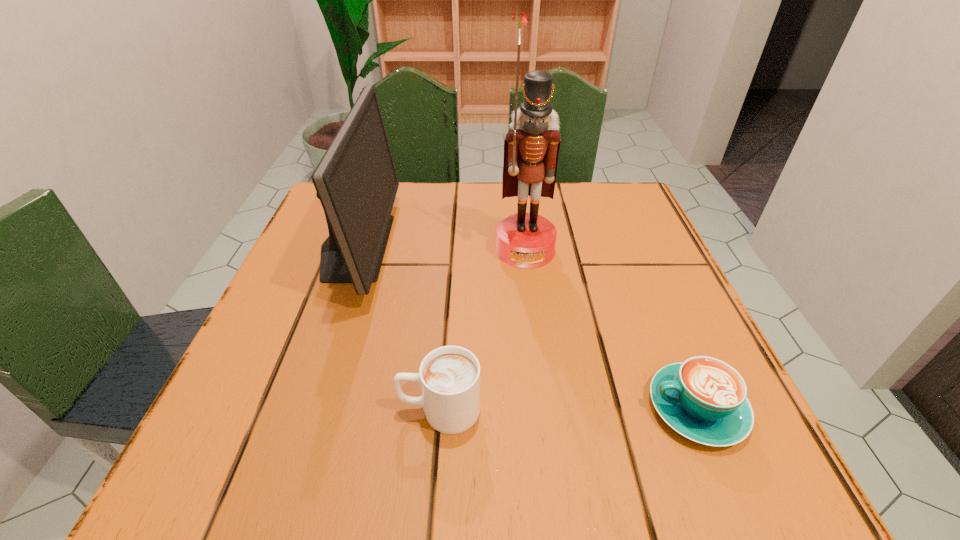
Locate an element on the screen. The width and height of the screenshot is (960, 540). unoccupied position between the rightmost object and the nutcracker is located at coordinates click(x=611, y=329).

Where is `blank region between the third object from right to left and the tallest object`? This screenshot has width=960, height=540. blank region between the third object from right to left and the tallest object is located at coordinates (482, 330).

Find the location of `free point between the left cappuccino and the nutcracker`. free point between the left cappuccino and the nutcracker is located at coordinates (482, 330).

Where is `free space between the leftmost object and the rightmost object`? The height and width of the screenshot is (540, 960). free space between the leftmost object and the rightmost object is located at coordinates (526, 327).

Where is `free space between the third object from right to left and the second object from right to left`? This screenshot has width=960, height=540. free space between the third object from right to left and the second object from right to left is located at coordinates (482, 330).

At what (x,y) coordinates should I click in order to perform the action: click on free space between the taller cappuccino and the leftmost object. Please return your answer as a coordinate pair (x, y). Image resolution: width=960 pixels, height=540 pixels. Looking at the image, I should click on (397, 328).

The image size is (960, 540). I want to click on vacant area that lies between the shorter cappuccino and the leftmost object, so [526, 327].

What are the coordinates of `empty space that is in between the nutcracker and the shortest object` in the screenshot? It's located at coord(611,329).

The height and width of the screenshot is (540, 960). In order to click on object that can be found as the closest to the taller cappuccino in this screenshot , I will do coord(356,181).

Locate an element on the screen. This screenshot has width=960, height=540. object that can be found as the third closest to the second tallest object is located at coordinates (704, 399).